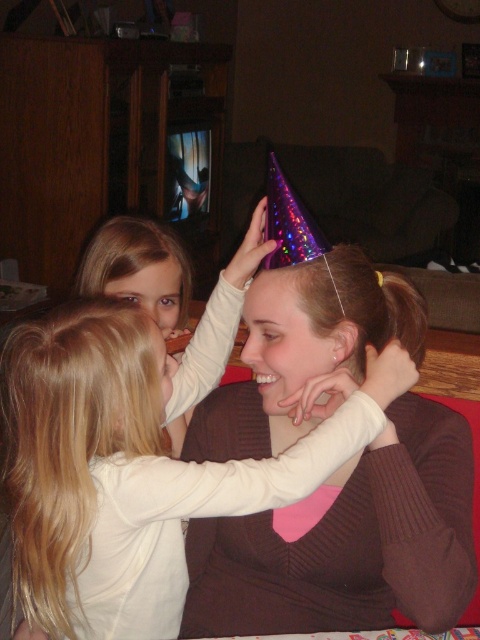
Does matte white shirt at center have a smaller size compared to blonde hair at center?

No, matte white shirt at center is not smaller than blonde hair at center.

Which is behind, point (142, 428) or point (24, 410)?

The point (142, 428) is behind.

Who is more distant from viewer, (108,461) or (96,305)?

Positioned behind is point (96,305).

Where is `matte white shirt at center`? Image resolution: width=480 pixels, height=640 pixels. matte white shirt at center is located at coordinates (134, 467).

Does purple shiny party hat at upper center appear on the left side of matte white shirt at center?

In fact, purple shiny party hat at upper center is to the right of matte white shirt at center.

Between point (268, 548) and point (120, 532), which one is positioned behind?

The point (268, 548) is more distant.

Where is `purple shiny party hat at upper center`? purple shiny party hat at upper center is located at coordinates (348, 541).

Measure the distance between blonde hair at center and blonde hair at upper left.

blonde hair at center and blonde hair at upper left are 17.49 inches apart from each other.

Which of these two, blonde hair at center or blonde hair at upper left, stands taller?

Standing taller between the two is blonde hair at upper left.

Which is in front, point (0, 385) or point (124, 276)?

Positioned in front is point (124, 276).

Identify the location of blonde hair at center. (83, 384).